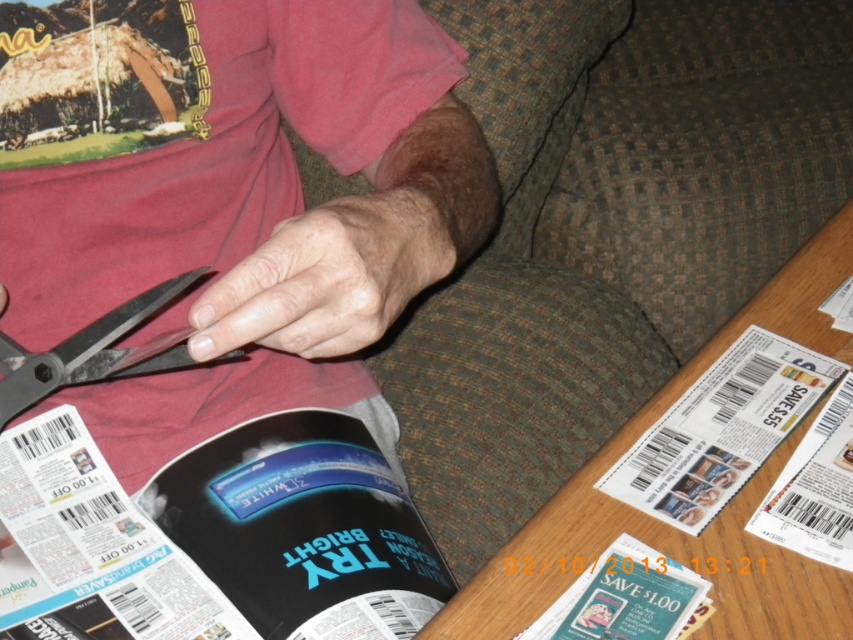
Consider the image. Does black matte scissors at left have a greater height compared to matte black magazine at lower center?

Indeed, black matte scissors at left has a greater height compared to matte black magazine at lower center.

Between point (4, 340) and point (705, 595), which one is positioned in front?

Positioned in front is point (705, 595).

Which is in front, point (111, 356) or point (544, 618)?

Point (544, 618)

The image size is (853, 640). Identify the location of black matte scissors at left. (96, 349).

Does metallic scissors at upper left appear under black matte scissors at left?

No, metallic scissors at upper left is not below black matte scissors at left.

Between metallic scissors at upper left and black matte scissors at left, which one appears on the right side from the viewer's perspective?

From the viewer's perspective, metallic scissors at upper left appears more on the right side.

What do you see at coordinates (259, 221) in the screenshot?
I see `metallic scissors at upper left` at bounding box center [259, 221].

Identify the location of metallic scissors at upper left. (259, 221).

Measure the distance between point (793, 419) and camera.

Point (793, 419) and camera are 20.86 inches apart.

Does point (757, 360) come behind point (827, 433)?

Yes.

This screenshot has height=640, width=853. Find the location of `white glossy coupon at lower right`. white glossy coupon at lower right is located at coordinates (720, 429).